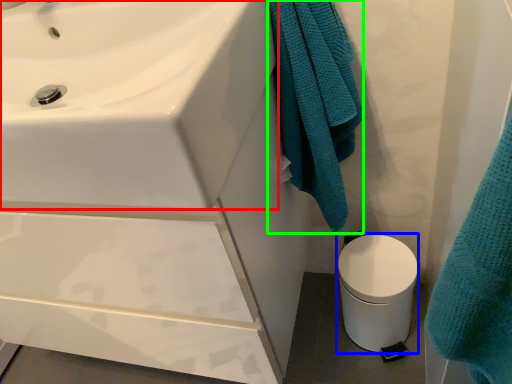
Question: Considering the real-world distances, which object is farthest from sink (highlighted by a red box)? toilet bowl (highlighted by a blue box) or bath towel (highlighted by a green box)?

Choices:
 (A) toilet bowl
 (B) bath towel

Answer: (A)